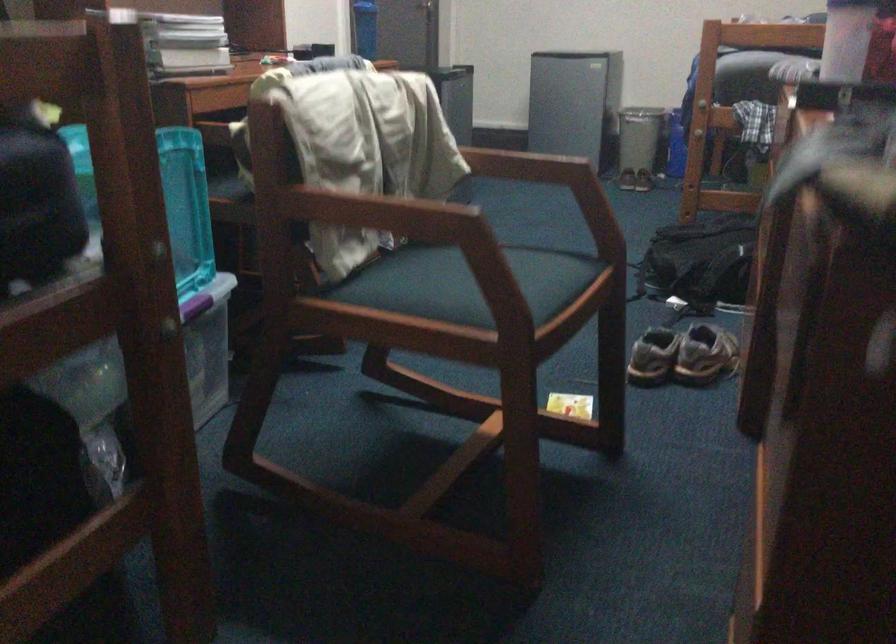
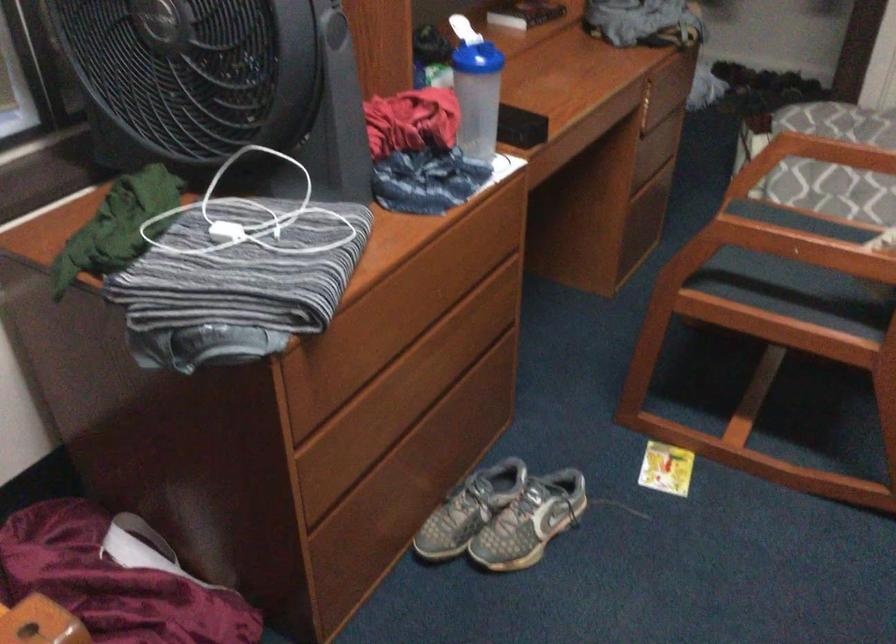
In the second image, find the point that corresponds to [687,334] in the first image.

(503, 516)